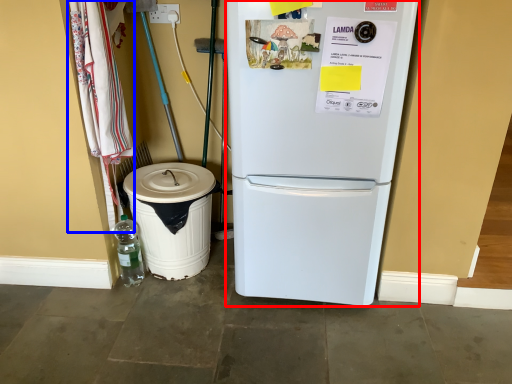
Question: Among these objects, which one is nearest to the camera, refrigerator (highlighted by a red box) or laundry (highlighted by a blue box)?

Choices:
 (A) refrigerator
 (B) laundry

Answer: (A)